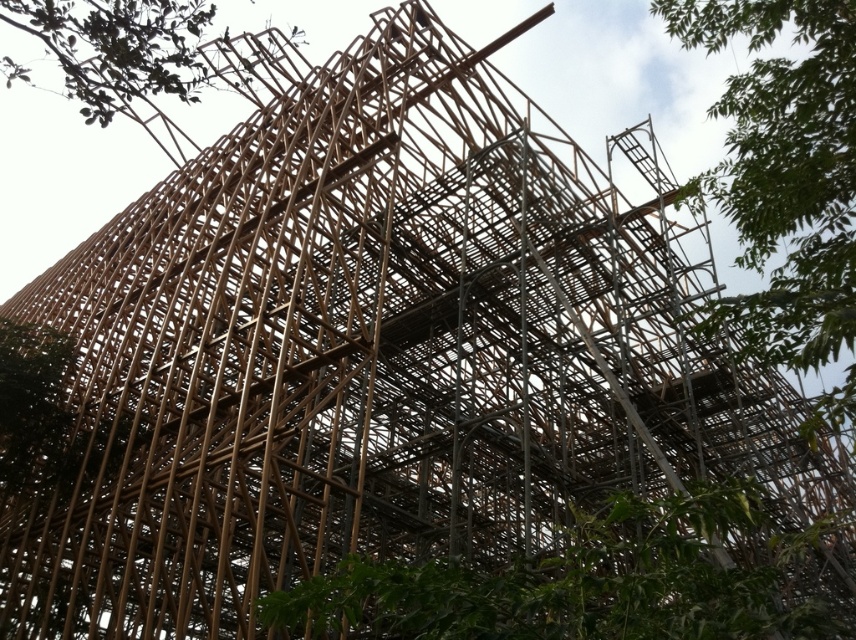
Between green leafy tree at upper right and green leafy tree at upper left, which one is positioned higher?

green leafy tree at upper left is above.

Who is more forward, (720, 12) or (192, 90)?

Point (720, 12)

Where is `green leafy tree at upper right`? green leafy tree at upper right is located at coordinates (783, 172).

Does green leafy tree at lower center have a smaller size compared to green leafy tree at upper left?

Yes, green leafy tree at lower center is smaller than green leafy tree at upper left.

Does green leafy tree at lower center appear on the left side of green leafy tree at upper left?

No, green leafy tree at lower center is not to the left of green leafy tree at upper left.

Between point (331, 595) and point (34, 6), which one is positioned behind?

Point (34, 6)

What are the coordinates of `green leafy tree at lower center` in the screenshot? It's located at (581, 582).

Does green leafy tree at lower center have a greater height compared to green leafy tree at upper right?

No.

Between green leafy tree at lower center and green leafy tree at upper right, which one appears on the left side from the viewer's perspective?

Positioned to the left is green leafy tree at lower center.

Is point (498, 609) behind point (706, 3)?

No, (498, 609) is closer to viewer.

Image resolution: width=856 pixels, height=640 pixels. Identify the location of green leafy tree at lower center. click(x=581, y=582).